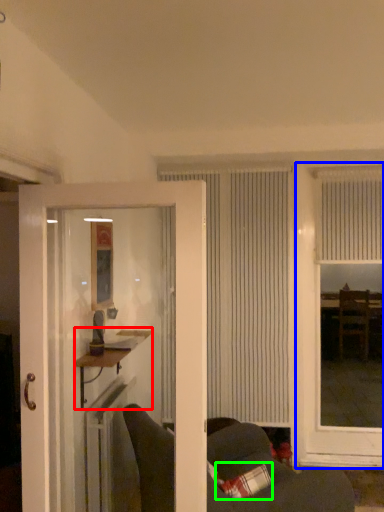
Question: Which is nearer to the table (highlighted by a red box)? window (highlighted by a blue box) or pillow (highlighted by a green box).

Choices:
 (A) window
 (B) pillow

Answer: (B)